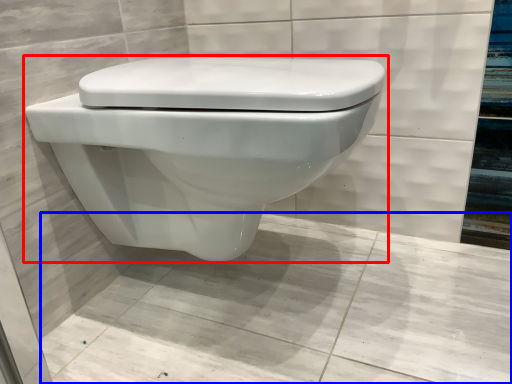
Question: Among these objects, which one is farthest to the camera, toilet (highlighted by a red box) or concrete (highlighted by a blue box)?

Choices:
 (A) toilet
 (B) concrete

Answer: (A)